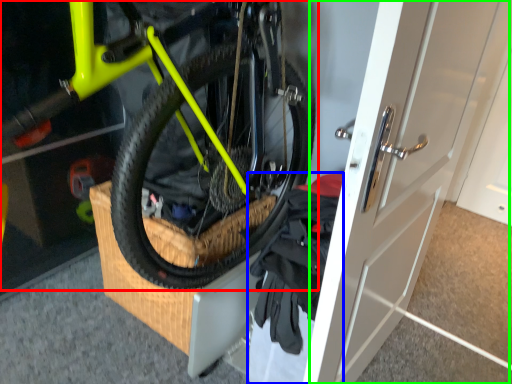
Question: Based on their relative distances, which object is farther from bicycle (highlighted by a red box)? Choose from clothing (highlighted by a blue box) and door (highlighted by a green box).

Choices:
 (A) clothing
 (B) door

Answer: (B)